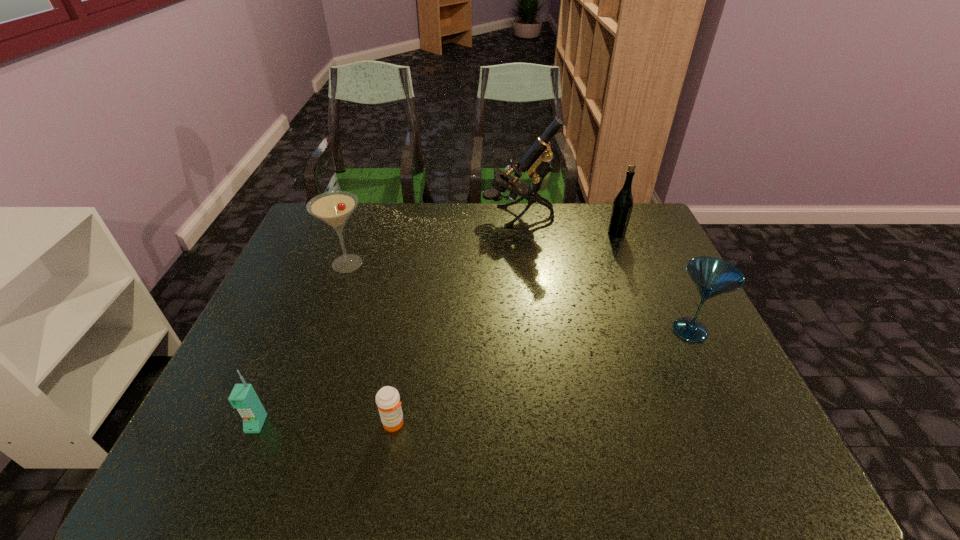
Locate an element on the screen. The width and height of the screenshot is (960, 540). martini that is at the left edge is located at coordinates (334, 208).

The width and height of the screenshot is (960, 540). Find the location of `cellular telephone present at the left edge`. cellular telephone present at the left edge is located at coordinates (243, 397).

Find the location of `beer bottle at the right edge`. beer bottle at the right edge is located at coordinates (622, 207).

Locate an element on the screen. The width and height of the screenshot is (960, 540). martini that is at the right edge is located at coordinates (711, 276).

Where is `object that is at the far right corner`? object that is at the far right corner is located at coordinates (622, 207).

The height and width of the screenshot is (540, 960). I want to click on vacant space at the far edge of the desktop, so click(414, 215).

In the image, there is a desktop. At what (x,y) coordinates should I click in order to perform the action: click on vacant space at the left edge. Please return your answer as a coordinate pair (x, y). This screenshot has height=540, width=960. Looking at the image, I should click on (309, 300).

Find the location of `free location at the right edge`. free location at the right edge is located at coordinates (636, 255).

This screenshot has width=960, height=540. In the image, there is a desktop. In order to click on blank space at the far left corner in this screenshot , I will do `click(318, 222)`.

You are a GUI agent. You are given a task and a screenshot of the screen. Output one action in this format:
    pyautogui.click(x=<x>, y=<y>)
    Task: Click on the vacant space at the far right corner
    This screenshot has height=540, width=960.
    Given the screenshot: What is the action you would take?
    pyautogui.click(x=635, y=212)